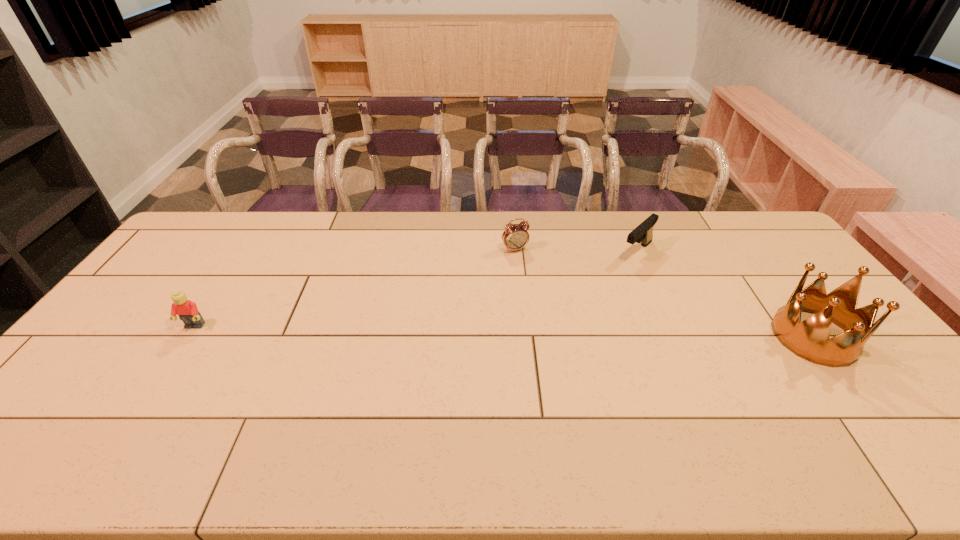
This screenshot has width=960, height=540. I want to click on Lego, so click(187, 311).

The image size is (960, 540). In order to click on the tallest object in this screenshot , I will do `click(810, 339)`.

At what (x,y) coordinates should I click in order to perform the action: click on the rightmost object. Please return your answer as a coordinate pair (x, y). The width and height of the screenshot is (960, 540). Looking at the image, I should click on (810, 339).

Where is `the second object from left to right`? the second object from left to right is located at coordinates (515, 236).

What are the coordinates of `the third object from left to right` in the screenshot? It's located at (643, 233).

In order to click on blank space located on the face of the leftmost object in this screenshot , I will do 176,355.

Image resolution: width=960 pixels, height=540 pixels. I want to click on vacant position located on the back of the tallest object, so click(x=752, y=254).

Locate an element on the screen. The image size is (960, 540). free point located on the face of the alarm clock is located at coordinates (545, 294).

At what (x,y) coordinates should I click in order to perform the action: click on free spot located 0.240m on the face of the alarm clock. Please return your answer as a coordinate pair (x, y). Looking at the image, I should click on (549, 300).

Identify the location of free space located 0.370m on the face of the alarm clock. The image size is (960, 540). (569, 330).